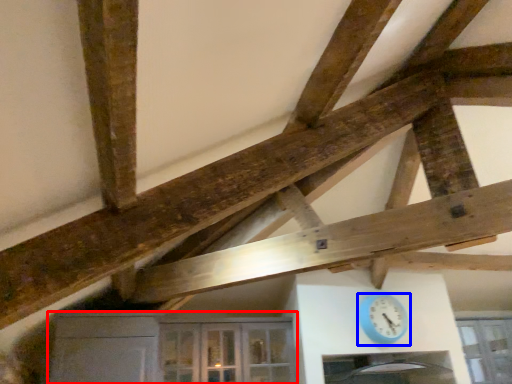
Question: Among these objects, which one is farthest to the camera, cabinetry (highlighted by a red box) or clock (highlighted by a blue box)?

Choices:
 (A) cabinetry
 (B) clock

Answer: (B)